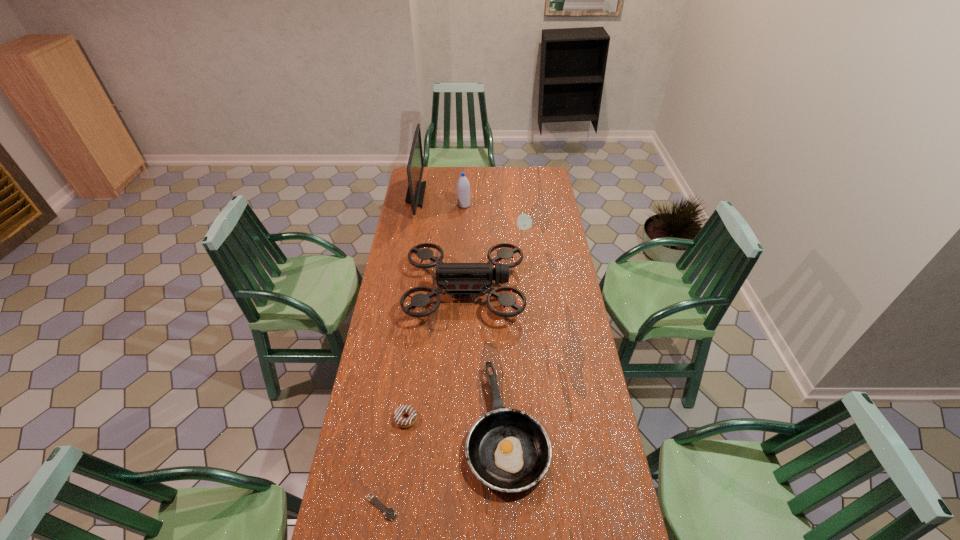
Identify the location of the tallest object. (416, 189).

Locate an element on the screen. Image resolution: width=960 pixels, height=540 pixels. water bottle is located at coordinates 463,186.

Locate an element on the screen. the third tallest object is located at coordinates (456, 278).

Where is `drone`? drone is located at coordinates (456, 278).

Image resolution: width=960 pixels, height=540 pixels. What are the coordinates of `the fifth nearest object` in the screenshot? It's located at (524, 222).

Locate an element on the screen. The width and height of the screenshot is (960, 540). apple is located at coordinates (524, 222).

Image resolution: width=960 pixels, height=540 pixels. I want to click on frying pan, so click(x=508, y=450).

The height and width of the screenshot is (540, 960). I want to click on doughnut, so click(404, 409).

Find the location of `watch`. watch is located at coordinates (389, 513).

The image size is (960, 540). I want to click on free region located 0.270m on the screen side of the tallest object, so click(469, 195).